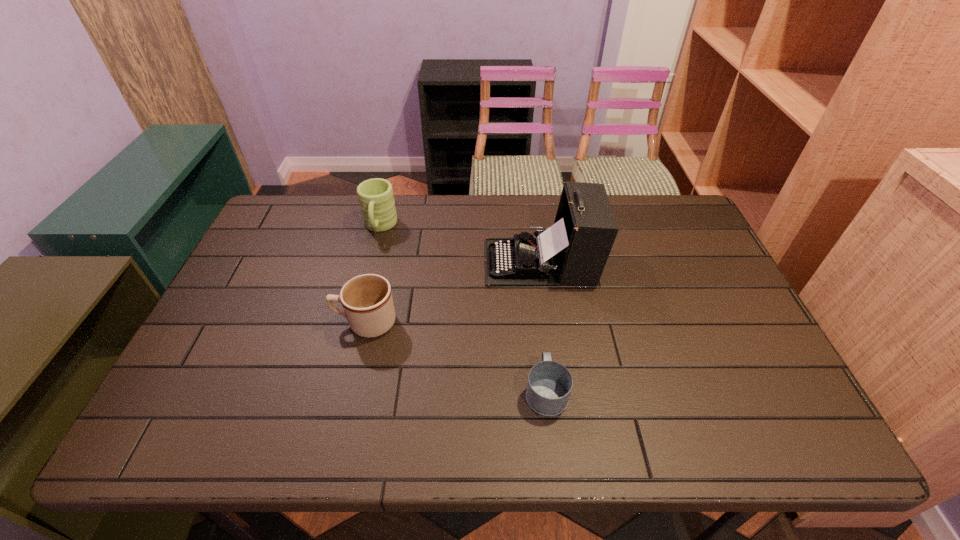
This screenshot has width=960, height=540. I want to click on typewriter, so click(x=574, y=251).

I want to click on the farthest mug, so click(376, 199).

Locate an element on the screen. the second nearest object is located at coordinates (367, 302).

Locate an element on the screen. Image resolution: width=960 pixels, height=540 pixels. the nearest object is located at coordinates (549, 385).

The width and height of the screenshot is (960, 540). In order to click on the shortest object in this screenshot , I will do `click(549, 385)`.

Find the location of `vacant space situated 0.320m inside the open case of the tallest object`. vacant space situated 0.320m inside the open case of the tallest object is located at coordinates (378, 262).

Identify the location of vacant space located inside the open case of the tallest object. (435, 262).

This screenshot has width=960, height=540. In order to click on vacant space located 0.400m inside the open case of the tallest object in this screenshot , I will do `click(352, 262)`.

This screenshot has width=960, height=540. I want to click on free space located 0.370m on the side of the farthest mug with the handle, so click(351, 336).

At what (x,y) coordinates should I click in order to perform the action: click on free spot located 0.250m on the side of the second farthest mug with the handle. Please return your answer as a coordinate pair (x, y). Looking at the image, I should click on (240, 322).